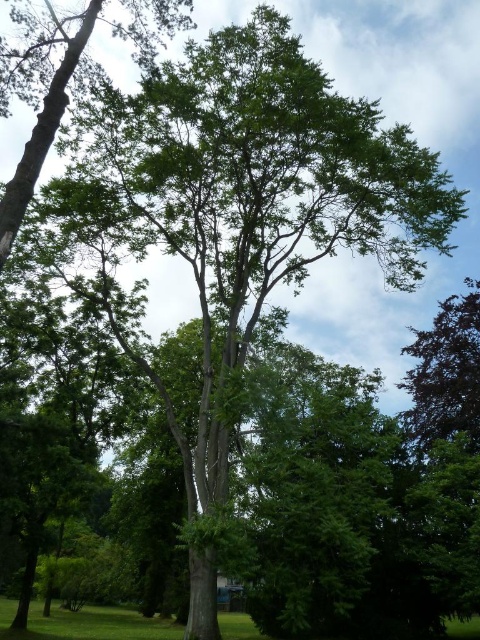
Describe the element at coordinates (63, 76) in the screenshot. I see `green leafy tree at center` at that location.

Looking at this image, does green leafy tree at center appear on the right side of dark green leafy tree at upper right?

In fact, green leafy tree at center is to the left of dark green leafy tree at upper right.

Is point (19, 83) less distant than point (475, 360)?

Yes, point (19, 83) is in front of point (475, 360).

Locate an element on the screen. This screenshot has width=480, height=640. green leafy tree at center is located at coordinates (63, 76).